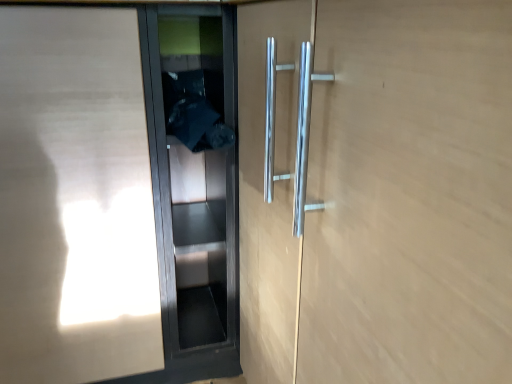
Question: Does matte wood elevator door at left, acting as the first elevator door starting from the left, have a larger size compared to black glass elevator door at center, the first elevator door in the right-to-left sequence?

Choices:
 (A) yes
 (B) no

Answer: (A)

Question: Is matte wood elevator door at left, arranged as the second elevator door when viewed from the right, beside black glass elevator door at center, the second elevator door in the left-to-right sequence?

Choices:
 (A) yes
 (B) no

Answer: (B)

Question: Is matte wood elevator door at left, acting as the first elevator door starting from the left, wider than black glass elevator door at center, the second elevator door in the left-to-right sequence?

Choices:
 (A) no
 (B) yes

Answer: (B)

Question: Considering the relative sizes of matte wood elevator door at left, arranged as the second elevator door when viewed from the right, and black glass elevator door at center, the first elevator door in the right-to-left sequence, in the image provided, is matte wood elevator door at left, arranged as the second elevator door when viewed from the right, smaller than black glass elevator door at center, the first elevator door in the right-to-left sequence,?

Choices:
 (A) yes
 (B) no

Answer: (B)

Question: Is matte wood elevator door at left, arranged as the second elevator door when viewed from the right, outside of black glass elevator door at center, the second elevator door in the left-to-right sequence?

Choices:
 (A) yes
 (B) no

Answer: (A)

Question: Does matte wood elevator door at left, arranged as the second elevator door when viewed from the right, appear on the left side of black glass elevator door at center, the second elevator door in the left-to-right sequence?

Choices:
 (A) no
 (B) yes

Answer: (B)

Question: Is black glass elevator door at center, the second elevator door in the left-to-right sequence, at the left side of matte wood elevator door at left, acting as the first elevator door starting from the left?

Choices:
 (A) yes
 (B) no

Answer: (B)

Question: Can you confirm if black glass elevator door at center, the second elevator door in the left-to-right sequence, is shorter than matte wood elevator door at left, acting as the first elevator door starting from the left?

Choices:
 (A) no
 (B) yes

Answer: (B)

Question: Is black glass elevator door at center, the first elevator door in the right-to-left sequence, located outside matte wood elevator door at left, acting as the first elevator door starting from the left?

Choices:
 (A) no
 (B) yes

Answer: (B)

Question: Is black glass elevator door at center, the first elevator door in the right-to-left sequence, thinner than matte wood elevator door at left, arranged as the second elevator door when viewed from the right?

Choices:
 (A) no
 (B) yes

Answer: (B)

Question: Can you confirm if black glass elevator door at center, the second elevator door in the left-to-right sequence, is positioned to the right of matte wood elevator door at left, acting as the first elevator door starting from the left?

Choices:
 (A) yes
 (B) no

Answer: (A)

Question: Considering the relative sizes of black glass elevator door at center, the first elevator door in the right-to-left sequence, and matte wood elevator door at left, acting as the first elevator door starting from the left, in the image provided, is black glass elevator door at center, the first elevator door in the right-to-left sequence, taller than matte wood elevator door at left, acting as the first elevator door starting from the left,?

Choices:
 (A) no
 (B) yes

Answer: (A)

Question: Is point (164, 241) positioned closer to the camera than point (112, 196)?

Choices:
 (A) closer
 (B) farther

Answer: (B)